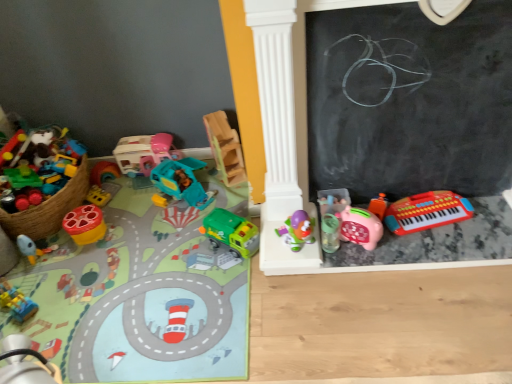
I want to click on space that is in front of wooden blocks at center, which is the 7th toy from left to right, so click(225, 198).